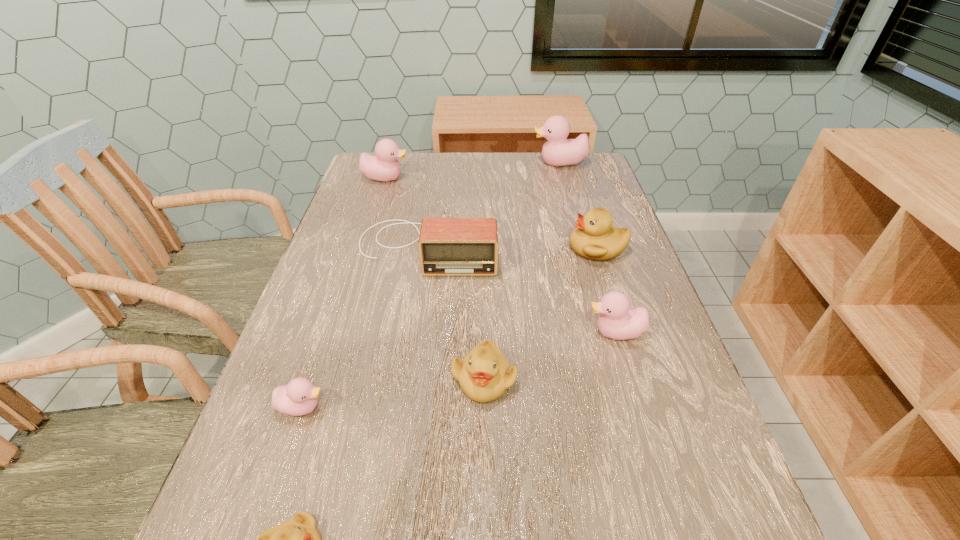
At what (x,y) coordinates should I click in order to perform the action: click on vacant point located between the fifth farthest object and the second biggest pink duckling. Please return your answer as a coordinate pair (x, y). This screenshot has height=540, width=960. Looking at the image, I should click on (500, 255).

Image resolution: width=960 pixels, height=540 pixels. Identify the location of vacant region between the second nearest pink duckling and the farthest yellow duckling. (607, 291).

Find the location of a particular element. Image resolution: width=960 pixels, height=540 pixels. free space between the third smallest pink duckling and the biggest pink duckling is located at coordinates (472, 171).

Identify the location of free point between the fourth duckling from right to left and the radio receiver. This screenshot has width=960, height=540. (455, 313).

In order to click on free spot between the biggest yellow duckling and the biggest pink duckling in this screenshot , I will do `click(579, 206)`.

Where is `unoccupied position between the fifth farthest object and the radio receiver`? unoccupied position between the fifth farthest object and the radio receiver is located at coordinates (521, 290).

What are the coordinates of `free space between the fourth nearest object and the fourth duckling from left to right` in the screenshot? It's located at (550, 356).

This screenshot has height=540, width=960. I want to click on object that ranks as the second closest to the nearest pink duckling, so click(x=484, y=374).

Image resolution: width=960 pixels, height=540 pixels. In order to click on object that stands as the fifth closest to the tallest object in this screenshot , I will do `click(484, 374)`.

Identify which duckling is located as the second nearest to the third smallest pink duckling. Please provide its 2D coordinates. Your answer should be formatted as a tuple, i.e. [(x, y)], where the tuple contains the x and y coordinates of a point satisfying the conditions above.

[(595, 238)]